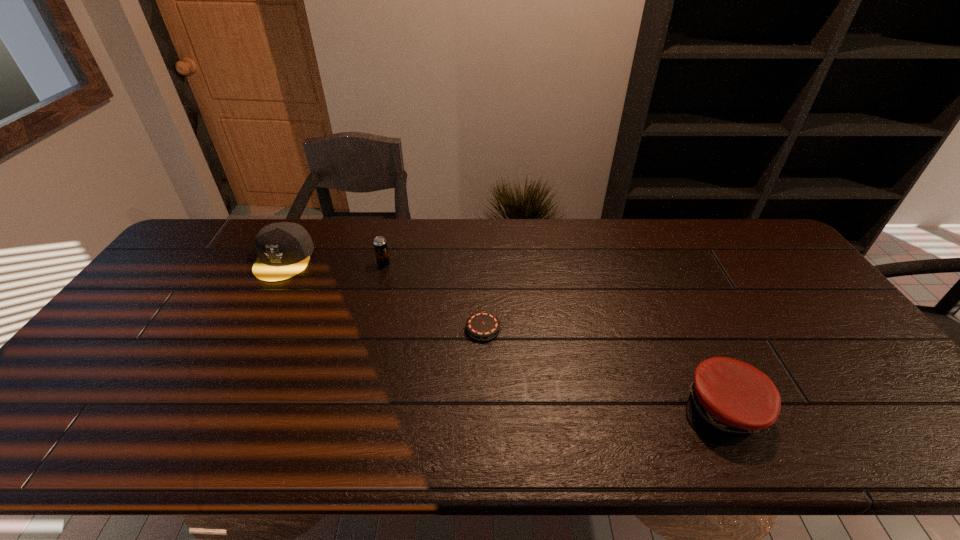
You are a GUI agent. You are given a task and a screenshot of the screen. Output one action in this format:
    pyautogui.click(x=<x>, y=<y>)
    Task: Click on the unoccupied area between the shortest object and the nearer cap
    This screenshot has width=960, height=540.
    Given the screenshot: What is the action you would take?
    pyautogui.click(x=603, y=369)

This screenshot has height=540, width=960. Find the location of `vacant area that lies between the farther cap and the third object from right to left`. vacant area that lies between the farther cap and the third object from right to left is located at coordinates (334, 261).

Locate an element on the screen. The width and height of the screenshot is (960, 540). empty space that is in between the beer can and the nearer cap is located at coordinates (554, 336).

Where is `unoccupied position between the farther cap and the second nearest object`? unoccupied position between the farther cap and the second nearest object is located at coordinates (383, 294).

The image size is (960, 540). Identify the location of vacant area that lies between the nearest object and the second object from right to left. (603, 369).

Locate an element on the screen. The height and width of the screenshot is (540, 960). vacant area that lies between the beer can and the second object from right to left is located at coordinates (433, 296).

In order to click on free area in between the left cap and the second object from right to left in this screenshot , I will do point(383,294).

The image size is (960, 540). In order to click on vacant space in between the third object from right to left and the farther cap in this screenshot , I will do `click(334, 261)`.

Identify the location of blank region between the left cap and the shorter cap. (504, 334).

Identify which object is the closest to the shorter cap. Please provide its 2D coordinates. Your answer should be formatted as a tuple, i.e. [(x, y)], where the tuple contains the x and y coordinates of a point satisfying the conditions above.

[(481, 326)]